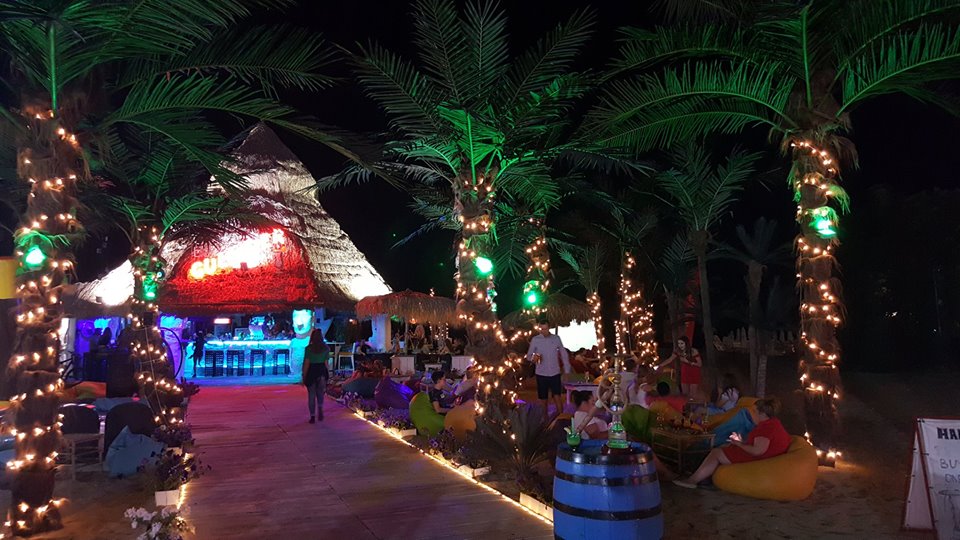
Locate an element on the screen. Image resolution: width=960 pixels, height=540 pixels. wooden chairs is located at coordinates (83, 420), (111, 421).